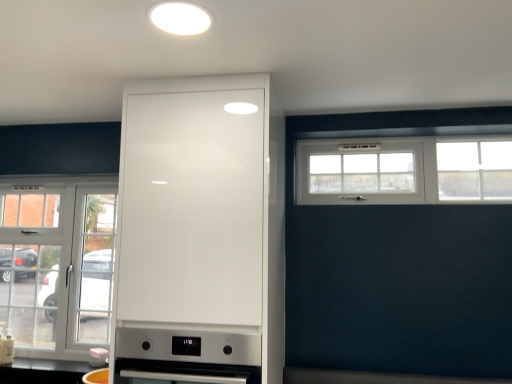
Measure the distance between point (387,143) and camera.

A distance of 2.39 meters exists between point (387,143) and camera.

Image resolution: width=512 pixels, height=384 pixels. In order to click on satin silver oven at center, which is the 1th appliance in front-to-back order in this screenshot , I will do [188, 354].

Find the location of a particular element. The height and width of the screenshot is (384, 512). clear glass door at left, marked as the second window in a front-to-back arrangement is located at coordinates (57, 263).

In the scene shown: In order to face matte white kettle at lower center, the first appliance when ordered from bottom to top, should I rotate leftwards or rightwards?

To face it directly, rotate left by 20.024 degrees.

Describe the element at coordinates (180, 18) in the screenshot. I see `white matte light fixture at upper center` at that location.

At what (x,y) coordinates should I click in order to perform the action: click on white plastic window at upper right, which is the 2th window from left to right. Please return your answer as a coordinate pair (x, y). The image size is (512, 384). Looking at the image, I should click on (404, 170).

Looking at this image, considering the sizes of objects clear glass door at left, the 1th window viewed from the left, and satin silver oven at center, which ranks as the 1th appliance in right-to-left order, in the image provided, who is smaller, clear glass door at left, the 1th window viewed from the left, or satin silver oven at center, which ranks as the 1th appliance in right-to-left order,?

With smaller size is clear glass door at left, the 1th window viewed from the left.

Is the surface of clear glass door at left, which appears as the 2th window when viewed from the top, in direct contact with satin silver oven at center, placed as the second appliance when sorted from left to right?

They are not placed beside each other.

Which of these two, white plastic window at upper right, acting as the first window starting from the top, or clear glass door at left, acting as the second window starting from the right, is wider?

Wider between the two is clear glass door at left, acting as the second window starting from the right.

Is white plastic window at upper right, acting as the first window starting from the top, taller than clear glass door at left, which appears as the 2th window when viewed from the top?

No.

Consider the image. Is there a large distance between white plastic window at upper right, acting as the first window starting from the top, and clear glass door at left, acting as the second window starting from the right?

white plastic window at upper right, acting as the first window starting from the top, is far away from clear glass door at left, acting as the second window starting from the right.

Considering the positions of objects white plastic window at upper right, which is counted as the second window, starting from the back, and clear glass door at left, placed as the 1th window when sorted from bottom to top, in the image provided, who is more to the right, white plastic window at upper right, which is counted as the second window, starting from the back, or clear glass door at left, placed as the 1th window when sorted from bottom to top,?

Positioned to the right is white plastic window at upper right, which is counted as the second window, starting from the back.

Measure the distance from matte white kettle at lower center, the 1th appliance positioned from the back, to clear glass door at left, which appears as the 2th window when viewed from the top.

The distance of matte white kettle at lower center, the 1th appliance positioned from the back, from clear glass door at left, which appears as the 2th window when viewed from the top, is 23.95 inches.

Is point (102, 355) positioned before point (6, 231)?

Yes, point (102, 355) is in front of point (6, 231).

The image size is (512, 384). There is a matte white kettle at lower center, placed as the second appliance when sorted from right to left. Find the location of `the 1st window above it (from a real-world perspective)`. the 1st window above it (from a real-world perspective) is located at coordinates (57, 263).

Is matte white kettle at lower center, the first appliance when ordered from bottom to top, facing away from clear glass door at left, placed as the 1th window when sorted from bottom to top?

Correct, matte white kettle at lower center, the first appliance when ordered from bottom to top, is looking away from clear glass door at left, placed as the 1th window when sorted from bottom to top.

Does point (204, 128) appear closer or farther from the camera than point (53, 268)?

Clearly, point (204, 128) is closer to the camera than point (53, 268).

From the image's perspective, which one is positioned higher, white glossy cabinet at center or clear glass door at left, the 1th window viewed from the left?

From the image's view, white glossy cabinet at center is above.

Can you confirm if white glossy cabinet at center is positioned to the right of clear glass door at left, the 1th window viewed from the left?

Indeed, white glossy cabinet at center is positioned on the right side of clear glass door at left, the 1th window viewed from the left.

In the scene shown: Relative to clear glass door at left, marked as the second window in a front-to-back arrangement, is white glossy cabinet at center in front or behind?

In the image, white glossy cabinet at center appears in front of clear glass door at left, marked as the second window in a front-to-back arrangement.

What are the coordinates of `the 1st window behind when counting from the satin silver oven at center, placed as the second appliance when sorted from left to right` in the screenshot? It's located at (404, 170).

Is white plastic window at upper right, which appears as the 2th window when ordered from the bottom, taller than satin silver oven at center, marked as the 2th appliance in a back-to-front arrangement?

No, white plastic window at upper right, which appears as the 2th window when ordered from the bottom, is not taller than satin silver oven at center, marked as the 2th appliance in a back-to-front arrangement.

How different are the orientations of white plastic window at upper right, acting as the first window starting from the top, and satin silver oven at center, which is the 1th appliance in front-to-back order, in degrees?

0.924 degrees.

Considering the sizes of objects satin silver oven at center, positioned as the 1th appliance in top-to-bottom order, and clear glass door at left, which appears as the 2th window when viewed from the top, in the image provided, who is wider, satin silver oven at center, positioned as the 1th appliance in top-to-bottom order, or clear glass door at left, which appears as the 2th window when viewed from the top,?

satin silver oven at center, positioned as the 1th appliance in top-to-bottom order, is wider.

Can you tell me how much satin silver oven at center, positioned as the 1th appliance in top-to-bottom order, and clear glass door at left, placed as the 1th window when sorted from bottom to top, differ in facing direction?

There is a 1.49-degree angle between the facing directions of satin silver oven at center, positioned as the 1th appliance in top-to-bottom order, and clear glass door at left, placed as the 1th window when sorted from bottom to top.

Between satin silver oven at center, which is the 1th appliance in front-to-back order, and clear glass door at left, marked as the second window in a front-to-back arrangement, which one appears on the left side from the viewer's perspective?

clear glass door at left, marked as the second window in a front-to-back arrangement, is more to the left.

Is satin silver oven at center, which is the 1th appliance in front-to-back order, positioned before clear glass door at left, marked as the second window in a front-to-back arrangement?

Yes, it is in front of clear glass door at left, marked as the second window in a front-to-back arrangement.

Which is in front, white plastic window at upper right, which appears as the 2th window when ordered from the bottom, or matte white kettle at lower center, arranged as the first appliance when viewed from the left?

white plastic window at upper right, which appears as the 2th window when ordered from the bottom, is in front.

Based on the photo, can you confirm if white plastic window at upper right, positioned as the first window in right-to-left order, is wider than matte white kettle at lower center, the 1th appliance positioned from the back?

Yes.

Is white plastic window at upper right, which is the 2th window from left to right, bigger or smaller than matte white kettle at lower center, placed as the second appliance when sorted from right to left?

white plastic window at upper right, which is the 2th window from left to right, is bigger than matte white kettle at lower center, placed as the second appliance when sorted from right to left.

Considering the relative sizes of white plastic window at upper right, which is counted as the 1th window, starting from the front, and matte white kettle at lower center, which is the 2th appliance from top to bottom, in the image provided, is white plastic window at upper right, which is counted as the 1th window, starting from the front, shorter than matte white kettle at lower center, which is the 2th appliance from top to bottom,?

In fact, white plastic window at upper right, which is counted as the 1th window, starting from the front, may be taller than matte white kettle at lower center, which is the 2th appliance from top to bottom.

Where is `the 2nd window behind when counting from the satin silver oven at center, which ranks as the 1th appliance in right-to-left order`? The height and width of the screenshot is (384, 512). the 2nd window behind when counting from the satin silver oven at center, which ranks as the 1th appliance in right-to-left order is located at coordinates (57, 263).

At what (x,y) coordinates should I click in order to perform the action: click on window above the clear glass door at left, which appears as the 2th window when viewed from the top (from a real-world perspective). Please return your answer as a coordinate pair (x, y). Image resolution: width=512 pixels, height=384 pixels. Looking at the image, I should click on (404, 170).

Looking at the image, which one is located further to white matte light fixture at upper center, satin silver oven at center, placed as the second appliance when sorted from left to right, or matte white kettle at lower center, which is the 2th appliance from top to bottom?

matte white kettle at lower center, which is the 2th appliance from top to bottom, lies further to white matte light fixture at upper center than the other object.

Estimate the real-world distances between objects in this image. Which object is closer to matte white kettle at lower center, the first appliance when ordered from bottom to top, white plastic window at upper right, which appears as the 2th window when ordered from the bottom, or clear glass door at left, placed as the 1th window when sorted from bottom to top?

Based on the image, clear glass door at left, placed as the 1th window when sorted from bottom to top, appears to be nearer to matte white kettle at lower center, the first appliance when ordered from bottom to top.

Based on their spatial positions, is white matte light fixture at upper center or matte white kettle at lower center, placed as the second appliance when sorted from right to left, closer to satin silver oven at center, which ranks as the 1th appliance in right-to-left order?

matte white kettle at lower center, placed as the second appliance when sorted from right to left, is positioned closer to the anchor satin silver oven at center, which ranks as the 1th appliance in right-to-left order.

Looking at the image, which one is located further to satin silver oven at center, which ranks as the 1th appliance in right-to-left order, white glossy cabinet at center or matte white kettle at lower center, placed as the second appliance when sorted from right to left?

Based on the image, matte white kettle at lower center, placed as the second appliance when sorted from right to left, appears to be further to satin silver oven at center, which ranks as the 1th appliance in right-to-left order.

Based on their spatial positions, is satin silver oven at center, positioned as the 1th appliance in top-to-bottom order, or matte white kettle at lower center, which is the 2th appliance from top to bottom, closer to clear glass door at left, the 1th window viewed from the left?

matte white kettle at lower center, which is the 2th appliance from top to bottom.

Estimate the real-world distances between objects in this image. Which object is further from clear glass door at left, the first window from the back, satin silver oven at center, which is the 2th appliance from bottom to top, or white plastic window at upper right, which is counted as the second window, starting from the back?

white plastic window at upper right, which is counted as the second window, starting from the back, is positioned further to the anchor clear glass door at left, the first window from the back.

Which object lies further to the anchor point clear glass door at left, the first window from the back, matte white kettle at lower center, arranged as the first appliance when viewed from the left, or satin silver oven at center, which is the 2th appliance from bottom to top?

satin silver oven at center, which is the 2th appliance from bottom to top.

Estimate the real-world distances between objects in this image. Which object is closer to white matte light fixture at upper center, matte white kettle at lower center, which is the 2th appliance from top to bottom, or clear glass door at left, placed as the 1th window when sorted from bottom to top?

clear glass door at left, placed as the 1th window when sorted from bottom to top.

Image resolution: width=512 pixels, height=384 pixels. Identify the location of appliance located between matte white kettle at lower center, arranged as the first appliance when viewed from the left, and white plastic window at upper right, which appears as the 2th window when ordered from the bottom, in the left-right direction. (188, 354).

Locate an element on the screen. Image resolution: width=512 pixels, height=384 pixels. cabinetry between white matte light fixture at upper center and matte white kettle at lower center, which is the 2th appliance in front-to-back order, vertically is located at coordinates (198, 225).

Where is `appliance between white matte light fixture at upper center and matte white kettle at lower center, arranged as the first appliance when viewed from the left, in the up-down direction`? appliance between white matte light fixture at upper center and matte white kettle at lower center, arranged as the first appliance when viewed from the left, in the up-down direction is located at coordinates (188, 354).

Where is `lighting between matte white kettle at lower center, which is the 2th appliance from top to bottom, and white plastic window at upper right, which is counted as the second window, starting from the back, in the horizontal direction`? lighting between matte white kettle at lower center, which is the 2th appliance from top to bottom, and white plastic window at upper right, which is counted as the second window, starting from the back, in the horizontal direction is located at coordinates (180, 18).